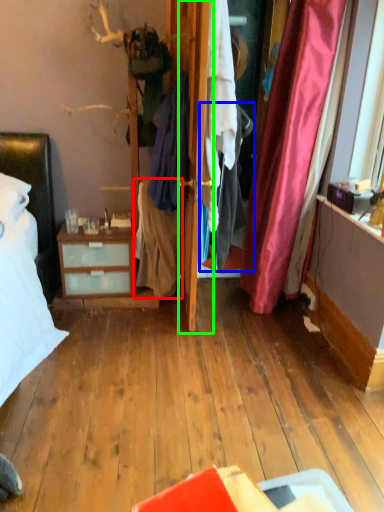
Question: Considering the real-world distances, which object is farthest from clothing (highlighted by a red box)? clothing (highlighted by a blue box) or door (highlighted by a green box)?

Choices:
 (A) clothing
 (B) door

Answer: (B)